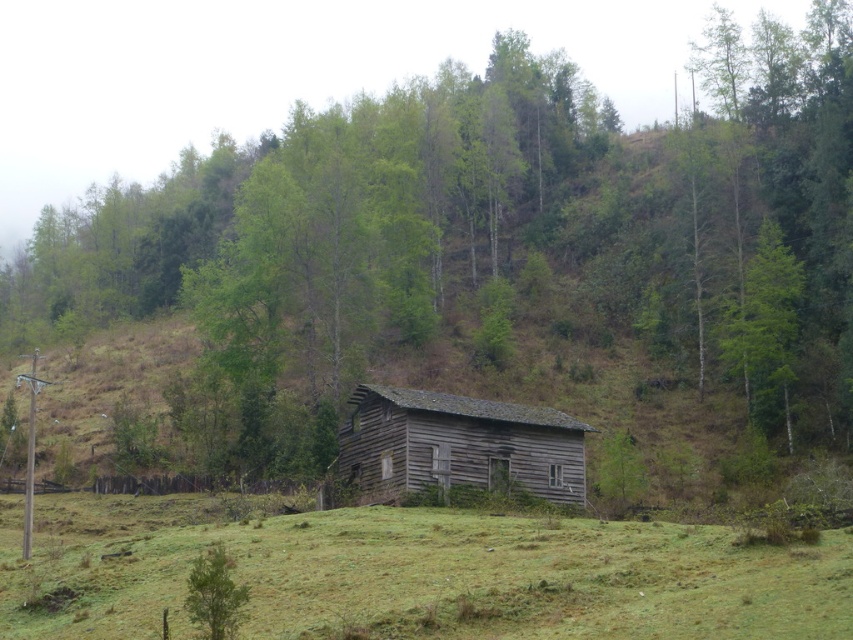
You are standing at the bottom of the hill looking up towards the weathered wood barn at center. To your left, there is a green grassy field at lower center. If you want to reach the barn first, which direction should you walk towards?

You should walk towards the weathered wood barn at center because the green grassy field at lower center is to the left of it, meaning the barn is directly ahead on the path upwards.

You are standing at the bottom of the hill looking towards the weathered wood barn at center. There is a green grassy field at lower center. If you want to walk directly to the barn, would you need to cross the field?

Yes, to reach the weathered wood barn at center, you would need to cross the green grassy field at lower center since it is located between you and the barn.

You are standing at the base of the hill and see the green grassy field at lower center and the weathered wood barn at center. Which object is closer to you?

The green grassy field at lower center is closer to you because it is positioned below the weathered wood barn at center, indicating it is lower on the slope.